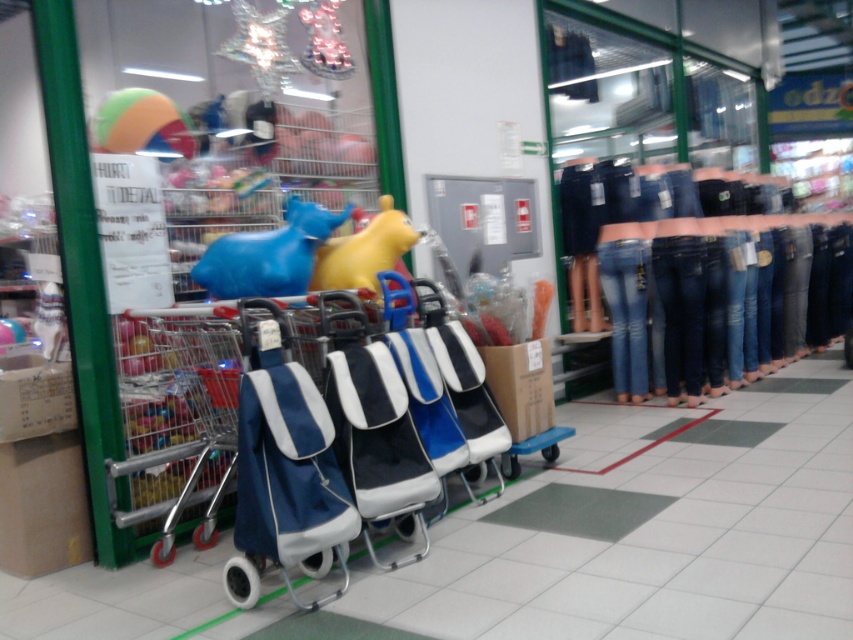
Question: Which of the following is the closest to the observer?

Choices:
 (A) (728, 346)
 (B) (337, 524)
 (C) (241, 248)
 (D) (692, 202)

Answer: (B)

Question: Is denim jeans at right to the right of blue rubber horse at center from the viewer's perspective?

Choices:
 (A) no
 (B) yes

Answer: (B)

Question: Which point appears farthest from the camera in this image?

Choices:
 (A) (326, 276)
 (B) (653, 172)
 (C) (733, 257)

Answer: (B)

Question: Is denim jeans at right thinner than denim at center?

Choices:
 (A) no
 (B) yes

Answer: (A)

Question: Is navy blue fabric shopping cart at center above denim at center?

Choices:
 (A) yes
 (B) no

Answer: (B)

Question: Which point is farther to the camera?

Choices:
 (A) (258, 364)
 (B) (287, 196)
 (C) (740, 252)

Answer: (C)